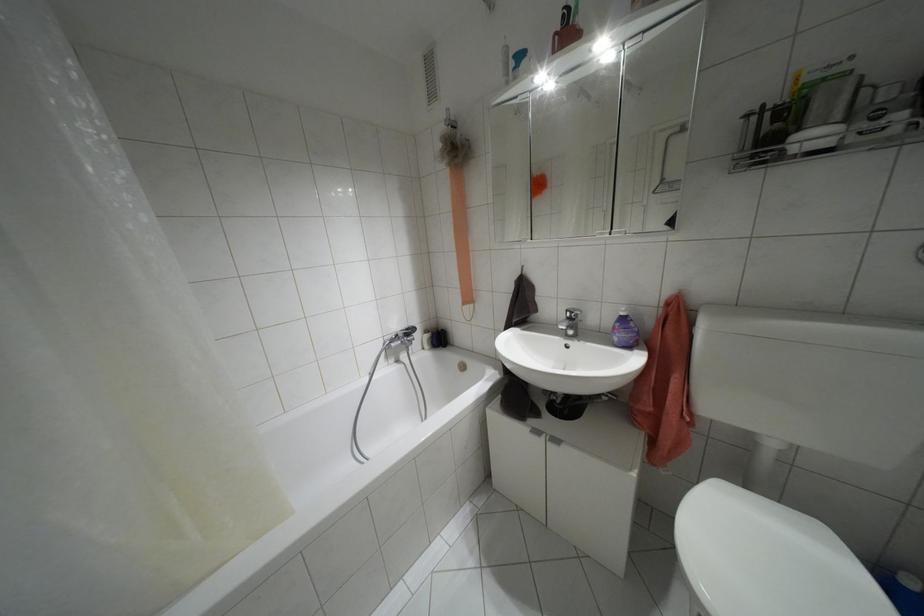
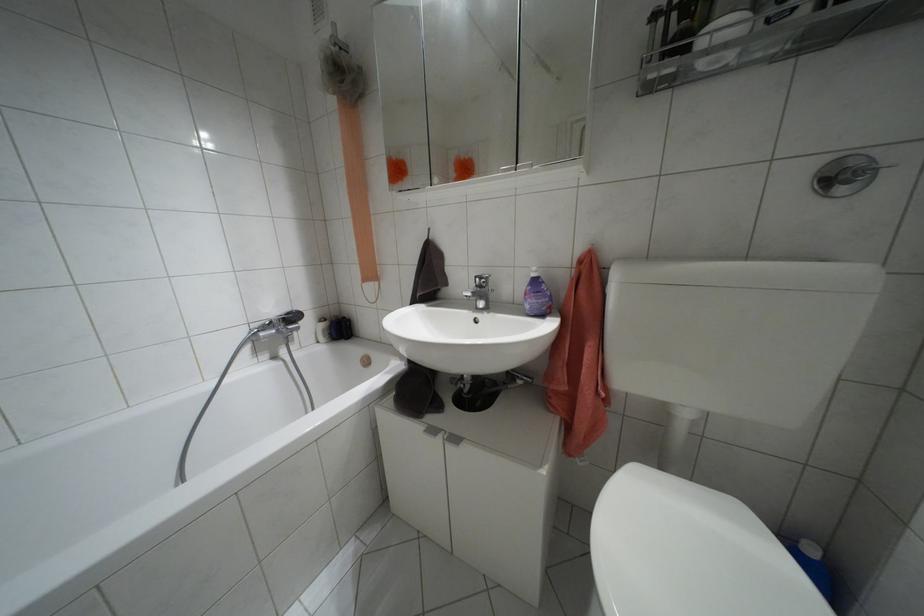
Where in the second image is the point corresponding to (x=536, y=431) from the first image?

(432, 430)